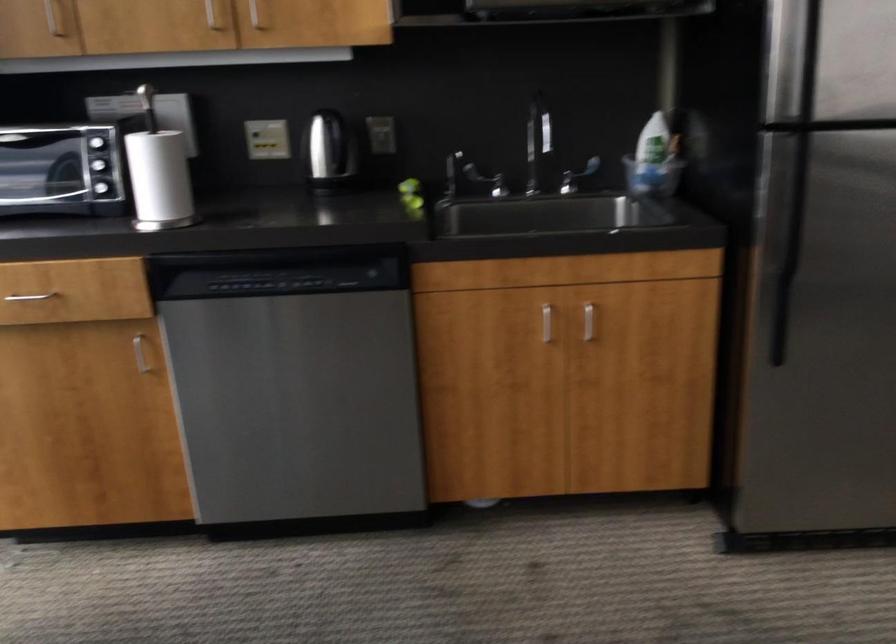
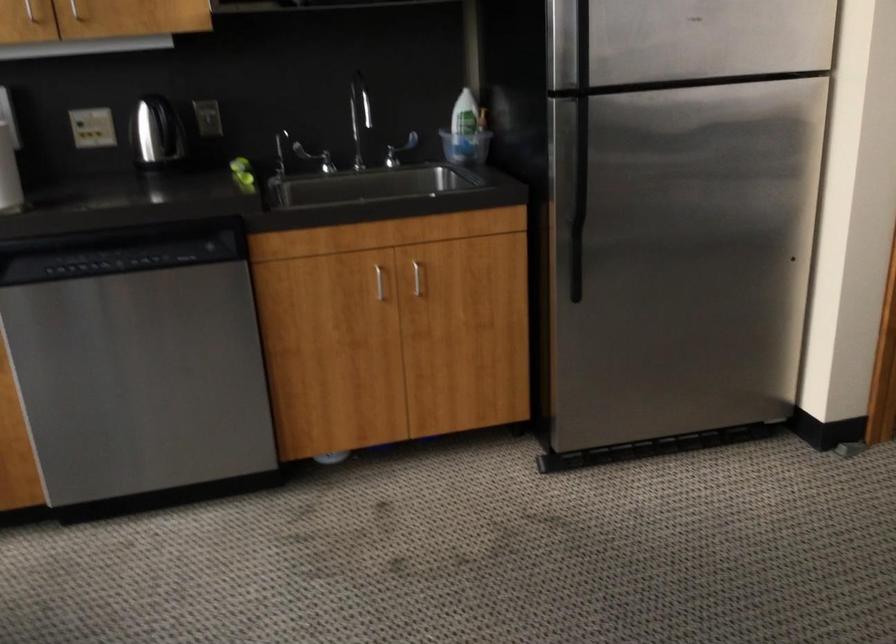
Question: Which direction would the cameraman need to move to produce the second image? Reply with the corresponding letter.

Choices:
 (A) Left
 (B) Right
 (C) Forward
 (D) Backward

Answer: (D)